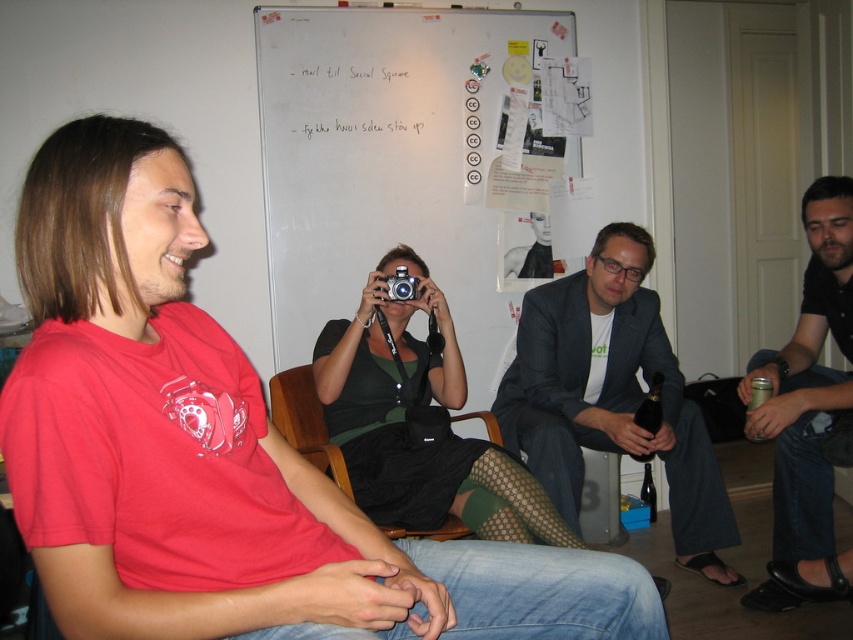
Question: Is black leather shoes at lower right above wooden armchair at center?

Choices:
 (A) no
 (B) yes

Answer: (B)

Question: Does matte black camera at center appear on the left side of black leather shoes at lower right?

Choices:
 (A) no
 (B) yes

Answer: (B)

Question: Which object is positioned farthest from the silver metallic camera at center?

Choices:
 (A) green fabric dress at center
 (B) matte black camera at center

Answer: (B)

Question: Is black leather shoes at lower right bigger than silver metallic camera at center?

Choices:
 (A) yes
 (B) no

Answer: (A)

Question: Which of the following is the closest to the observer?

Choices:
 (A) black leather shoes at lower right
 (B) dark gray suit at center

Answer: (A)

Question: Which object is closer to the camera taking this photo?

Choices:
 (A) dark gray suit at center
 (B) matte black camera at center

Answer: (B)